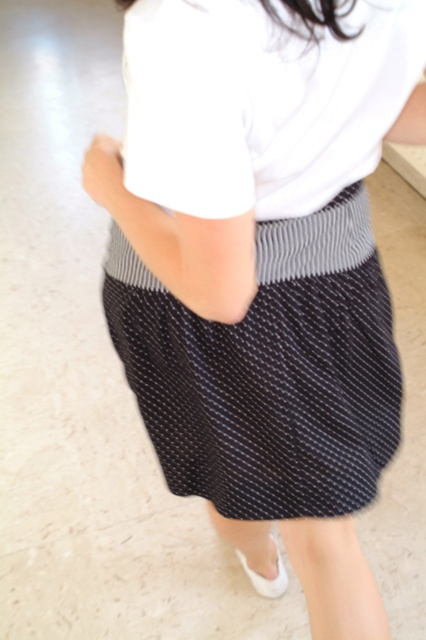
Is black textured skirt at center smaller than white cotton shirt at center?

No, black textured skirt at center is not smaller than white cotton shirt at center.

Does black textured skirt at center have a larger size compared to white cotton shirt at center?

Indeed, black textured skirt at center has a larger size compared to white cotton shirt at center.

Is point (333, 486) positioned in front of point (330, 198)?

No, (333, 486) is behind (330, 198).

Find the location of a particular element. black textured skirt at center is located at coordinates (270, 371).